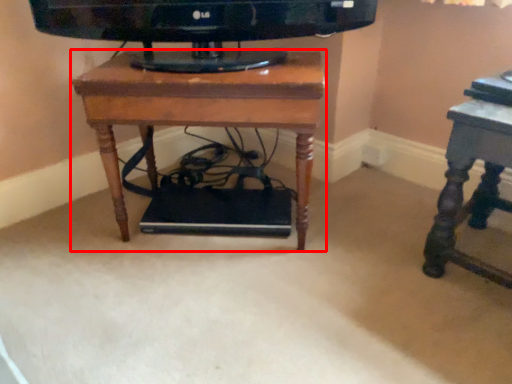
Question: In this image, where is table (annotated by the red box) located relative to table?

Choices:
 (A) left
 (B) right

Answer: (A)